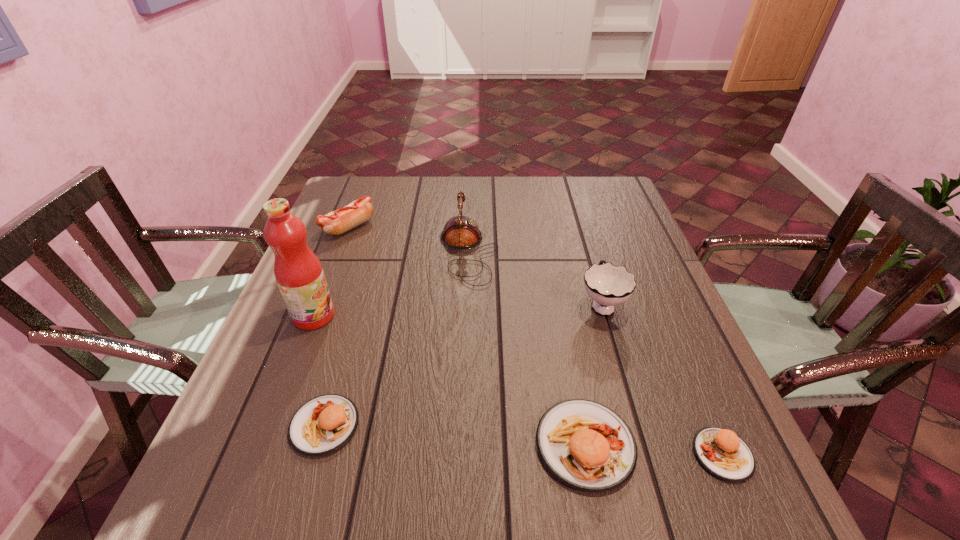
To make them evenly spaced by inserting another patty_(food) among them, please locate a free space for this new patty_(food). Please provide its 2D coordinates. Your answer should be formatted as a tuple, i.e. [(x, y)], where the tuple contains the x and y coordinates of a point satisfying the conditions above.

[(452, 435)]